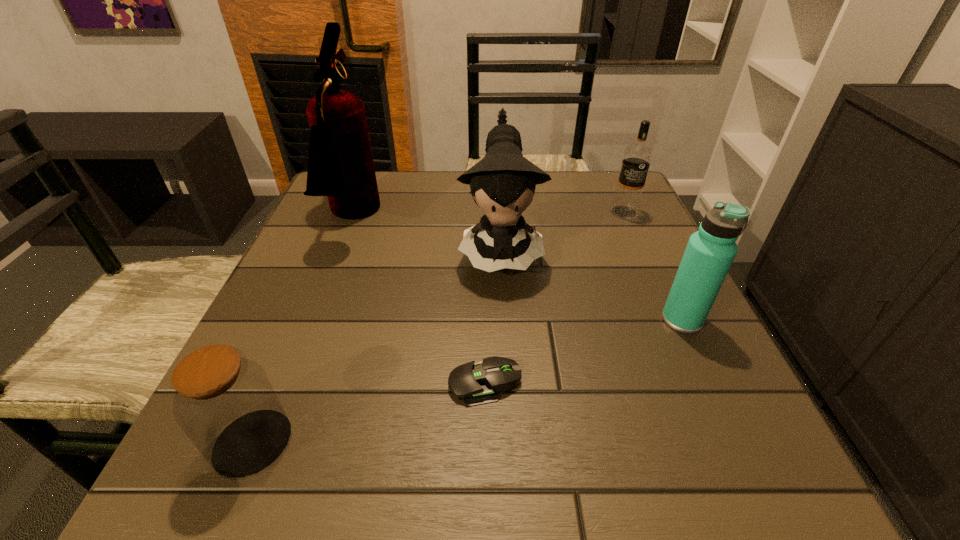
You are a GUI agent. You are given a task and a screenshot of the screen. Output one action in this format:
    pyautogui.click(x=<x>, y=<y>)
    Task: Click on the unoccupied position between the fire extinguisher and the fifth farthest object
    The image size is (960, 540).
    Given the screenshot: What is the action you would take?
    [x=419, y=300]

The image size is (960, 540). I want to click on free space between the doll and the fifth farthest object, so click(x=492, y=316).

Find the location of a particular element. vacant region between the shortest object and the vodka is located at coordinates (555, 298).

The height and width of the screenshot is (540, 960). Find the location of `empty space between the shortest object and the fire extinguisher`. empty space between the shortest object and the fire extinguisher is located at coordinates (419, 300).

In order to click on free space that is in between the fire extinguisher and the fifth tallest object in this screenshot , I will do pos(302,330).

The width and height of the screenshot is (960, 540). Find the location of `empty space between the thermos bottle and the computer mouse`. empty space between the thermos bottle and the computer mouse is located at coordinates (584, 352).

At what (x,y) coordinates should I click in order to perform the action: click on free space between the vodka and the third nearest object. Please return your answer as a coordinate pair (x, y). Looking at the image, I should click on (653, 266).

I want to click on free space between the doll and the tallest object, so click(426, 233).

This screenshot has height=540, width=960. Identify the location of object that is the third nearest to the second nearest object. (709, 254).

This screenshot has height=540, width=960. I want to click on object that is the fourth closest one to the doll, so click(x=709, y=254).